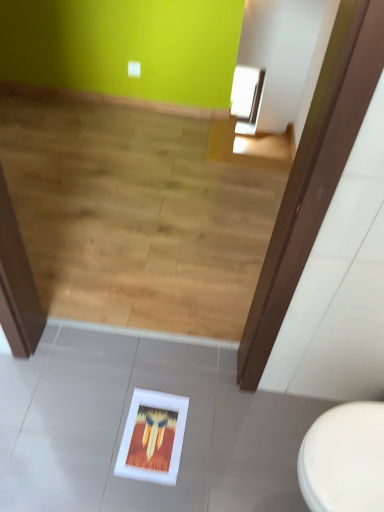
Find the location of a particular element. The image size is (384, 512). vacant space in front of white matte picture frame at lower center is located at coordinates (136, 495).